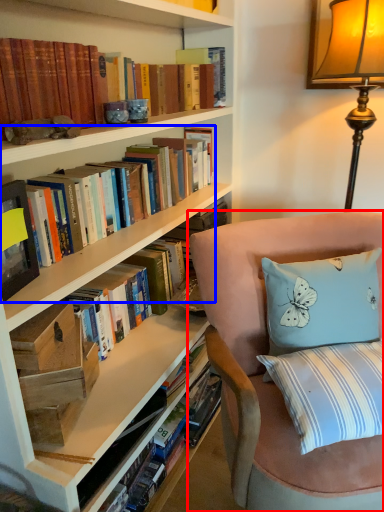
Question: Among these objects, which one is farthest to the camera, chair (highlighted by a red box) or book (highlighted by a blue box)?

Choices:
 (A) chair
 (B) book

Answer: (B)